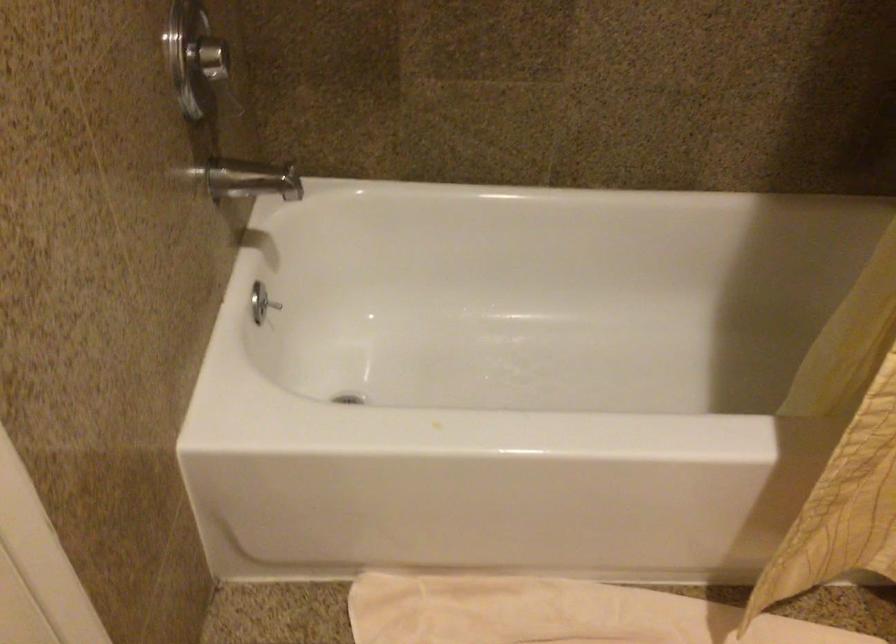
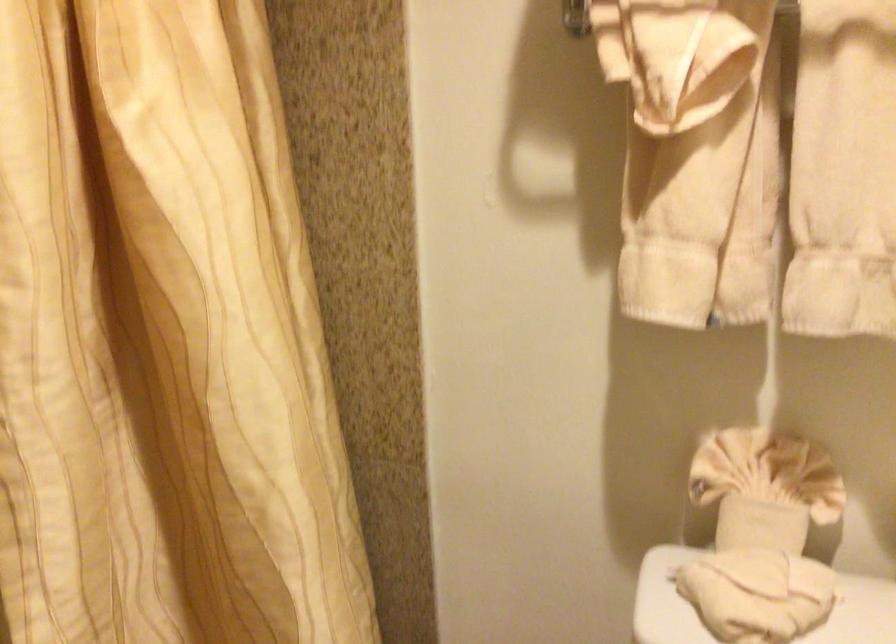
Question: The camera is either moving clockwise (left) or counter-clockwise (right) around the object. The first image is from the beginning of the video and the second image is from the end. Is the camera moving left or right when shooting the video?

Choices:
 (A) Left
 (B) Right

Answer: (A)